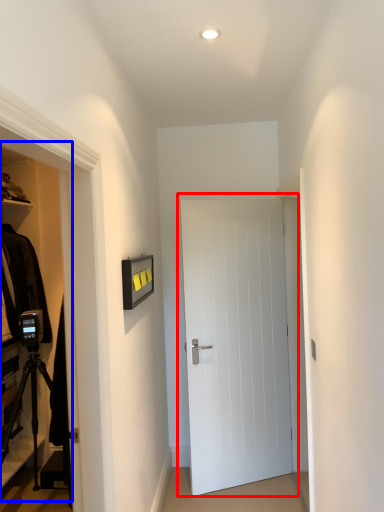
Question: Which object is closer to the camera taking this photo, door (highlighted by a red box) or dresser (highlighted by a blue box)?

Choices:
 (A) door
 (B) dresser

Answer: (B)